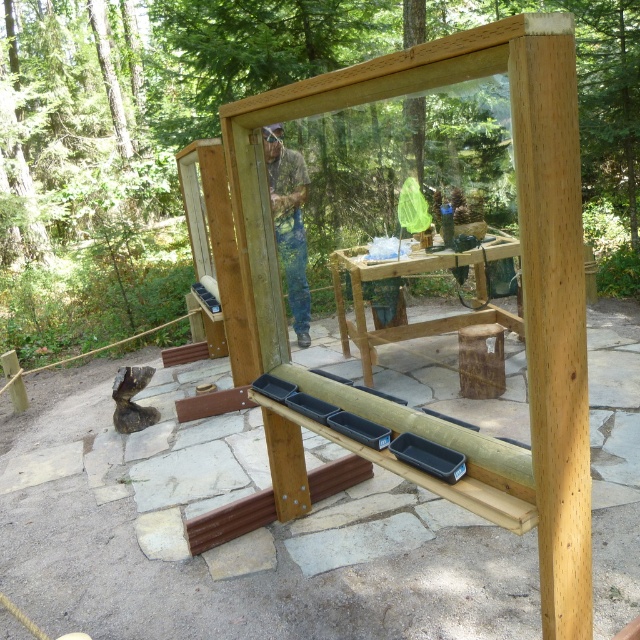
Can you confirm if natural wood frame at center is thinner than camouflage fabric shirt at center?

In fact, natural wood frame at center might be wider than camouflage fabric shirt at center.

Who is shorter, natural wood frame at center or camouflage fabric shirt at center?

natural wood frame at center is shorter.

Does point (394, 422) come in front of point (300, 291)?

That is True.

I want to click on natural wood frame at center, so click(x=515, y=330).